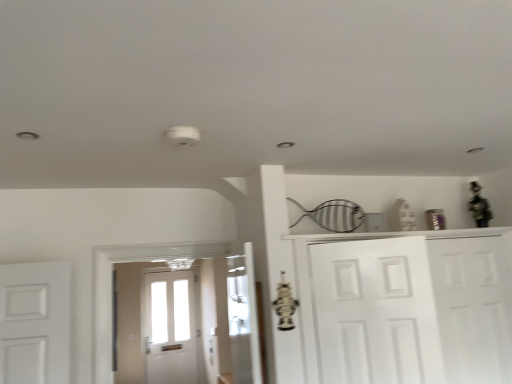
You are a GUI agent. You are given a task and a screenshot of the screen. Output one action in this format:
    pyautogui.click(x=<x>, y=<y>)
    Task: Click on the white matte door at center, which ranks as the second door in back-to-front order
    Image resolution: width=512 pixels, height=384 pixels.
    Given the screenshot: What is the action you would take?
    click(375, 312)

This screenshot has width=512, height=384. What do you see at coordinates (473, 307) in the screenshot?
I see `white matte door at right, the 2th door viewed from the left` at bounding box center [473, 307].

Identify the location of white matte cabinet at right. (390, 302).

How different are the orientations of white matte door at right, positioned as the second door in front-to-back order, and white matte cabinet at right in degrees?

The angle between the facing direction of white matte door at right, positioned as the second door in front-to-back order, and the facing direction of white matte cabinet at right is 1.67 degrees.

Is the surface of white matte door at right, positioned as the second door in front-to-back order, in direct contact with white matte cabinet at right?

white matte door at right, positioned as the second door in front-to-back order, is not next to white matte cabinet at right, and they're not touching.

From the image's perspective, is white matte door at right, positioned as the second door in front-to-back order, above white matte cabinet at right?

Yes, from the image's perspective, white matte door at right, positioned as the second door in front-to-back order, is above white matte cabinet at right.

Considering the sizes of white matte door at right, positioned as the first door in back-to-front order, and white matte cabinet at right in the image, is white matte door at right, positioned as the first door in back-to-front order, bigger or smaller than white matte cabinet at right?

white matte door at right, positioned as the first door in back-to-front order, is smaller than white matte cabinet at right.

From the image's perspective, which door is the 1st one above the white matte cabinet at right? Please provide its 2D coordinates.

[(473, 307)]

Does white matte cabinet at right have a smaller size compared to white matte door at right, positioned as the second door in front-to-back order?

No.

Would you say white matte cabinet at right is a long distance from white matte door at right, positioned as the first door in back-to-front order?

No, white matte cabinet at right is in close proximity to white matte door at right, positioned as the first door in back-to-front order.

Considering the sizes of objects white matte cabinet at right and white matte door at right, positioned as the first door in back-to-front order, in the image provided, who is thinner, white matte cabinet at right or white matte door at right, positioned as the first door in back-to-front order,?

white matte door at right, positioned as the first door in back-to-front order, is thinner.

Does white matte door at center, the second door when ordered from right to left, turn towards white matte door at right, positioned as the second door in front-to-back order?

No, white matte door at center, the second door when ordered from right to left, does not turn towards white matte door at right, positioned as the second door in front-to-back order.

Does white matte door at center, which ranks as the second door in back-to-front order, come behind white matte door at right, positioned as the first door in back-to-front order?

No, the depth of white matte door at center, which ranks as the second door in back-to-front order, is less than that of white matte door at right, positioned as the first door in back-to-front order.

Considering the positions of point (340, 380) and point (500, 344), is point (340, 380) closer or farther from the camera than point (500, 344)?

Clearly, point (340, 380) is closer to the camera than point (500, 344).

Can you tell me how much white matte cabinet at right and white matte door at center, positioned as the first door in front-to-back order, differ in facing direction?

The angle between the facing direction of white matte cabinet at right and the facing direction of white matte door at center, positioned as the first door in front-to-back order, is 30.1 degrees.

In the scene shown: Can you confirm if white matte cabinet at right is smaller than white matte door at center, which ranks as the second door in back-to-front order?

No.

Considering the relative sizes of white matte cabinet at right and white matte door at center, the 1th door from the left, in the image provided, is white matte cabinet at right wider than white matte door at center, the 1th door from the left,?

Yes.

Considering the relative sizes of white matte door at right, positioned as the first door in back-to-front order, and white matte door at center, the 1th door from the left, in the image provided, is white matte door at right, positioned as the first door in back-to-front order, thinner than white matte door at center, the 1th door from the left,?

In fact, white matte door at right, positioned as the first door in back-to-front order, might be wider than white matte door at center, the 1th door from the left.

Is point (487, 359) positioned before point (399, 322)?

No, (487, 359) is further to viewer.

From the image's perspective, is white matte door at right, positioned as the first door in back-to-front order, above or below white matte door at center, positioned as the first door in front-to-back order?

white matte door at right, positioned as the first door in back-to-front order, is below white matte door at center, positioned as the first door in front-to-back order.

Can you confirm if white matte door at right, the 1th door when ordered from right to left, is positioned to the left of white matte door at center, positioned as the first door in front-to-back order?

No.

From the image's perspective, which door is the 2nd one above the white matte cabinet at right? Please provide its 2D coordinates.

[(375, 312)]

From the image's perspective, is white matte door at center, the 1th door from the left, beneath white matte cabinet at right?

Incorrect, from the image's perspective, white matte door at center, the 1th door from the left, is higher than white matte cabinet at right.

Who is more distant, white matte door at center, which ranks as the second door in back-to-front order, or white matte cabinet at right?

white matte cabinet at right is behind.

Is white matte door at center, which ranks as the second door in back-to-front order, next to white matte cabinet at right?

Yes.

Find the location of a particular element. door behind the white matte cabinet at right is located at coordinates (473, 307).

The height and width of the screenshot is (384, 512). I want to click on dresser below the white matte door at right, positioned as the first door in back-to-front order (from the image's perspective), so click(x=390, y=302).

Which object lies further to the anchor point white matte cabinet at right, white matte door at center, the 1th door from the left, or white matte door at right, positioned as the second door in front-to-back order?

Among the two, white matte door at right, positioned as the second door in front-to-back order, is located further to white matte cabinet at right.

Based on their spatial positions, is white matte door at right, the 2th door viewed from the left, or white matte door at center, the second door when ordered from right to left, further from white matte cabinet at right?

Among the two, white matte door at right, the 2th door viewed from the left, is located further to white matte cabinet at right.

In the scene shown: When comparing their distances from white matte door at right, the 2th door viewed from the left, does white matte cabinet at right or white matte door at center, which ranks as the second door in back-to-front order, seem further?

white matte cabinet at right is further to white matte door at right, the 2th door viewed from the left.

In the scene shown: From the image, which object appears to be farther from white matte door at right, positioned as the first door in back-to-front order, white matte door at center, positioned as the first door in front-to-back order, or white matte cabinet at right?

Based on the image, white matte cabinet at right appears to be further to white matte door at right, positioned as the first door in back-to-front order.

Estimate the real-world distances between objects in this image. Which object is closer to white matte door at center, positioned as the first door in front-to-back order, white matte door at right, positioned as the first door in back-to-front order, or white matte cabinet at right?

Among the two, white matte cabinet at right is located nearer to white matte door at center, positioned as the first door in front-to-back order.

From the image, which object appears to be nearer to white matte door at center, the second door when ordered from right to left, white matte cabinet at right or white matte door at right, positioned as the first door in back-to-front order?

white matte cabinet at right.

The width and height of the screenshot is (512, 384). Identify the location of dresser between white matte door at center, which ranks as the second door in back-to-front order, and white matte door at right, the 2th door viewed from the left, in the horizontal direction. (390, 302).